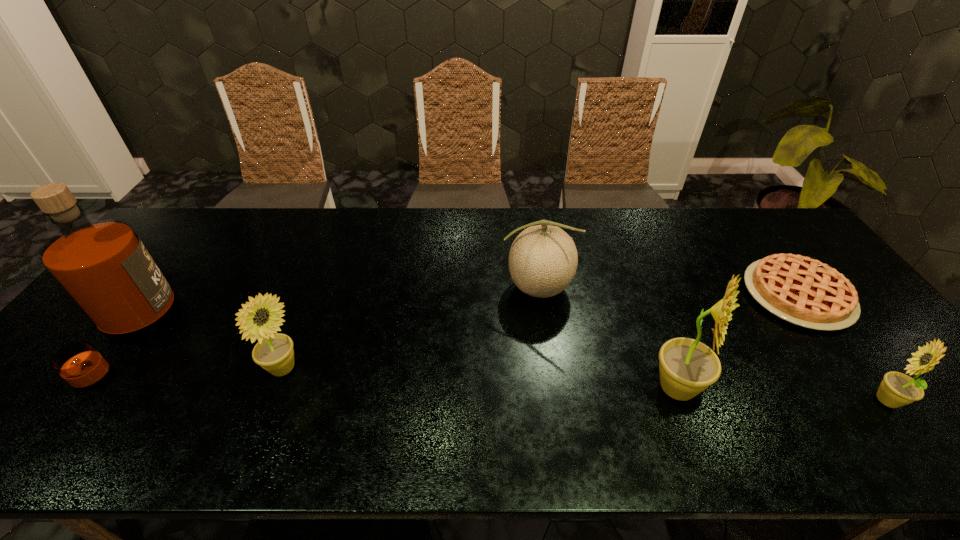
Find the location of a particular element. vacant area that lies between the rightmost sunflower and the leftmost sunflower is located at coordinates (585, 385).

This screenshot has height=540, width=960. I want to click on vacant area between the third object from left to right and the rightmost sunflower, so click(x=711, y=344).

Identify the location of unoccupied area between the shortest sunflower and the cantaloup. This screenshot has height=540, width=960. (711, 344).

This screenshot has width=960, height=540. Find the location of `unoccupied position between the leftmost object and the second shortest object`. unoccupied position between the leftmost object and the second shortest object is located at coordinates (508, 370).

The height and width of the screenshot is (540, 960). Find the location of `unoccupied position between the second sunflower from left to right and the cantaloup`. unoccupied position between the second sunflower from left to right and the cantaloup is located at coordinates (607, 339).

Identify the location of free space that is in between the leftmost object and the second shortest object. (508, 370).

This screenshot has height=540, width=960. What are the coordinates of `blank region between the pie and the fifth shortest object` in the screenshot? It's located at (737, 342).

Point out which object is positioned as the fifth nearest to the shortest sunflower. Please provide its 2D coordinates. Your answer should be formatted as a tuple, i.e. [(x, y)], where the tuple contains the x and y coordinates of a point satisfying the conditions above.

[(103, 266)]

Locate an element on the screen. object that is the third closest to the rightmost sunflower is located at coordinates (543, 259).

Where is `sunflower that is the second closest to the second object from left to right`? sunflower that is the second closest to the second object from left to right is located at coordinates [897, 389].